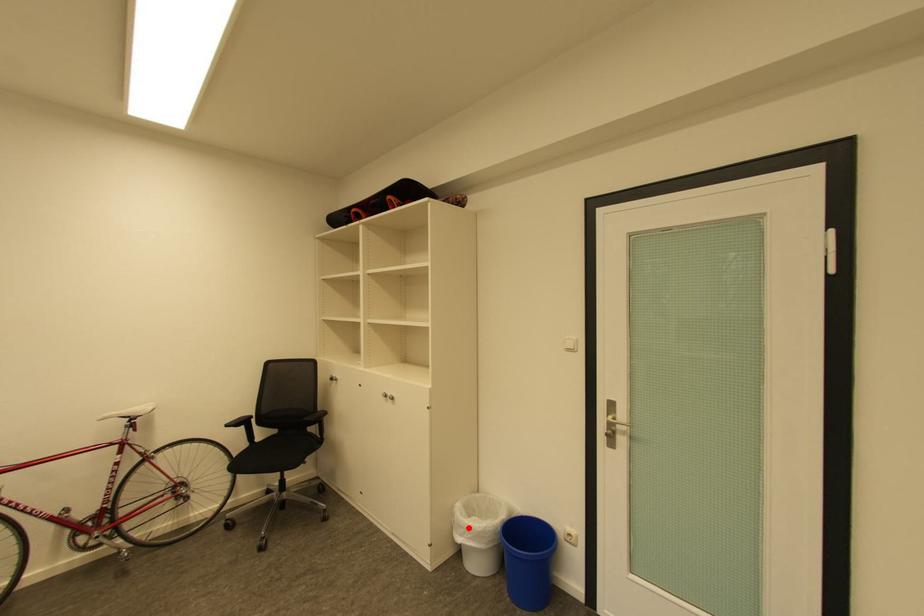
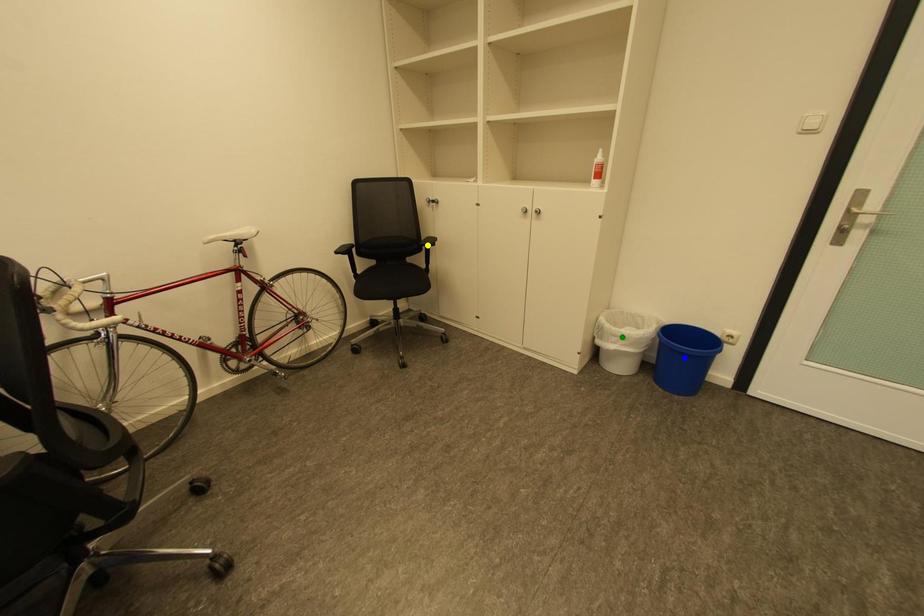
Question: I am providing you with two images of the same scene from different viewpoints. A red point is marked on the first image. You are given multiple points on the second image. Which mark in image 2 goes with the point in image 1?

Choices:
 (A) green point
 (B) yellow point
 (C) blue point

Answer: (A)